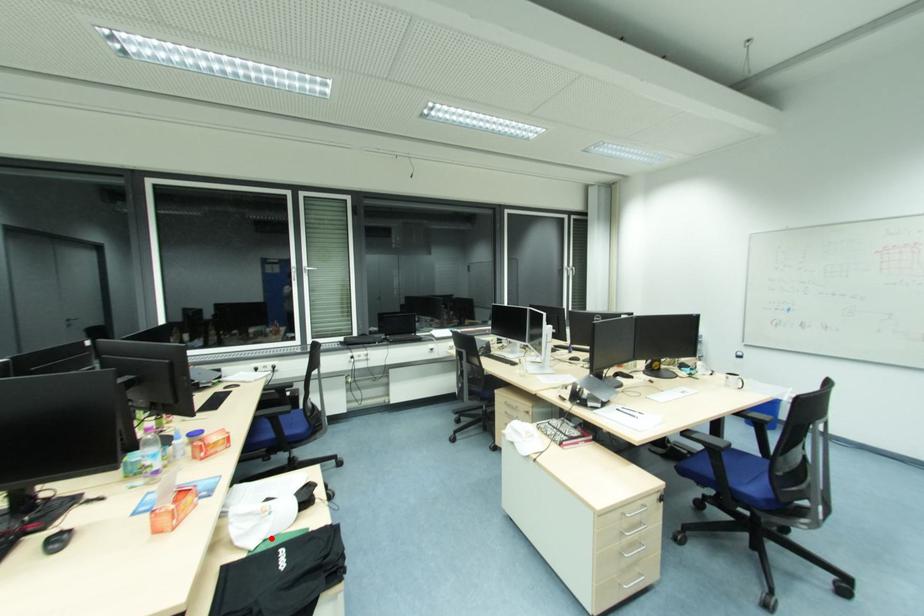
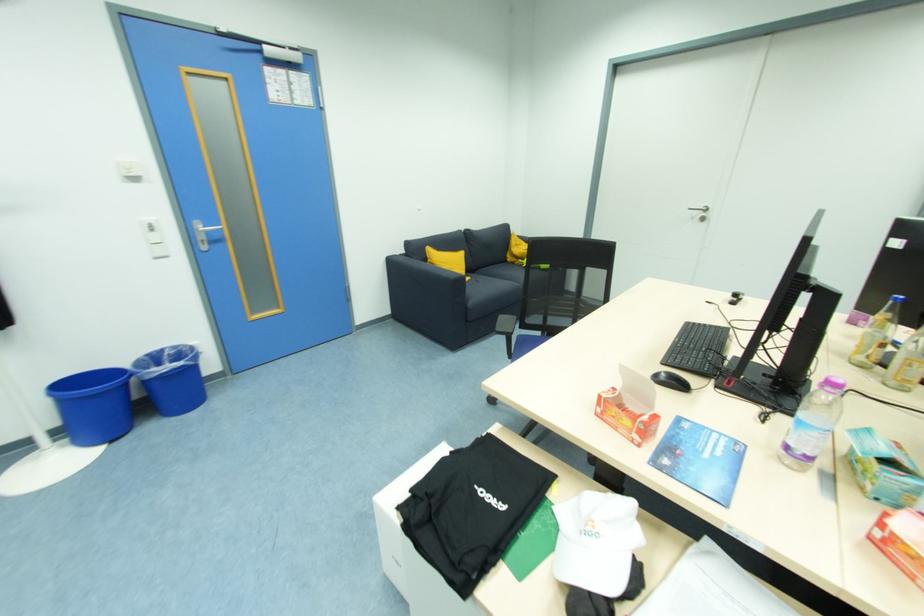
Locate, in the second image, the point that corresponds to the highlighted location in the first image.

(563, 535)